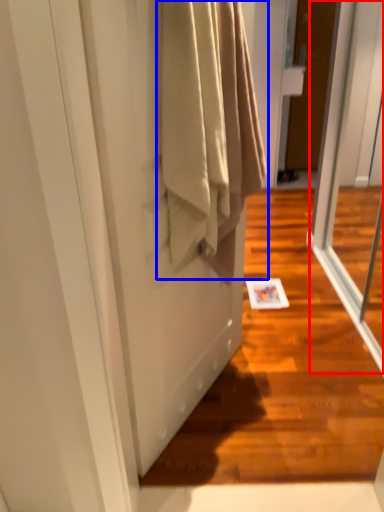
Question: Which point is closer to the camera, screen door (highlighted by a red box) or clothing (highlighted by a blue box)?

Choices:
 (A) screen door
 (B) clothing

Answer: (B)